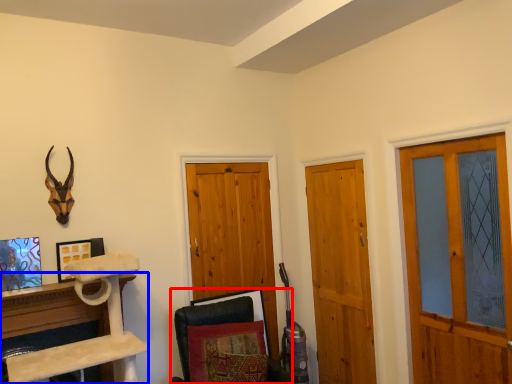
Question: Which point is closer to the camera, swivel chair (highlighted by a red box) or furniture (highlighted by a blue box)?

Choices:
 (A) swivel chair
 (B) furniture

Answer: (A)